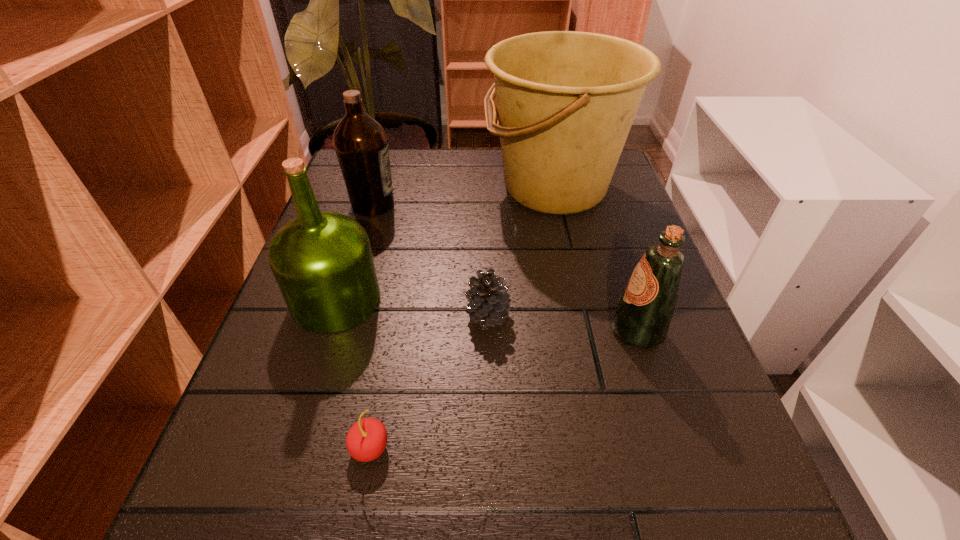
Identify the location of bucket. The width and height of the screenshot is (960, 540). (566, 100).

This screenshot has height=540, width=960. I want to click on the farthest olive oil, so click(x=361, y=145).

This screenshot has height=540, width=960. I want to click on the rightmost olive oil, so click(643, 316).

Identify the location of the shortest olive oil. This screenshot has width=960, height=540. (643, 316).

The height and width of the screenshot is (540, 960). I want to click on pinecone, so click(490, 303).

Locate an element on the screen. the nearest object is located at coordinates (366, 440).

Identify the location of cherry. The width and height of the screenshot is (960, 540). (366, 440).

Where is `vacant space located on the side of the bucket with the handle`? vacant space located on the side of the bucket with the handle is located at coordinates (426, 188).

Locate an element on the screen. The height and width of the screenshot is (540, 960). free space located on the side of the bucket with the handle is located at coordinates [x=337, y=188].

You are a GUI agent. You are given a task and a screenshot of the screen. Output one action in this format:
    pyautogui.click(x=<x>, y=<y>)
    Task: Click on the blank space located on the side of the bucket with the handle
    The height and width of the screenshot is (540, 960).
    Given the screenshot: What is the action you would take?
    pyautogui.click(x=373, y=188)